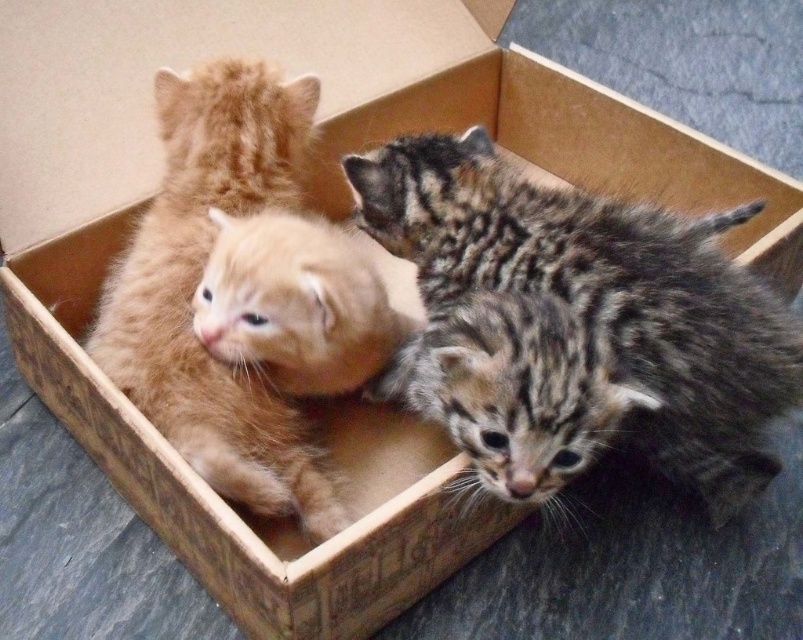
From the picture: Does tabby fur kitten at center have a lesser width compared to matte orange kitten at center?

No, tabby fur kitten at center is not thinner than matte orange kitten at center.

Looking at this image, is tabby fur kitten at center shorter than matte orange kitten at center?

No, tabby fur kitten at center is not shorter than matte orange kitten at center.

Who is more distant from viewer, (439, 248) or (296, 356)?

The point (439, 248) is more distant.

The width and height of the screenshot is (803, 640). I want to click on tabby fur kitten at center, so click(602, 291).

Between soft orange fur kitten at center and matte orange kitten at center, which one is positioned lower?

soft orange fur kitten at center is below.

Who is more distant from viewer, (178, 332) or (247, 284)?

The point (178, 332) is more distant.

Is point (316, 508) less distant than point (255, 323)?

No, (316, 508) is further to viewer.

This screenshot has width=803, height=640. Find the location of `soft orange fur kitten at center`. soft orange fur kitten at center is located at coordinates (198, 280).

Consider the image. Does tabby fur kitten at center have a greater height compared to soft orange fur kitten at center?

No.

Which is above, tabby fur kitten at center or soft orange fur kitten at center?

tabby fur kitten at center

I want to click on tabby fur kitten at center, so click(602, 291).